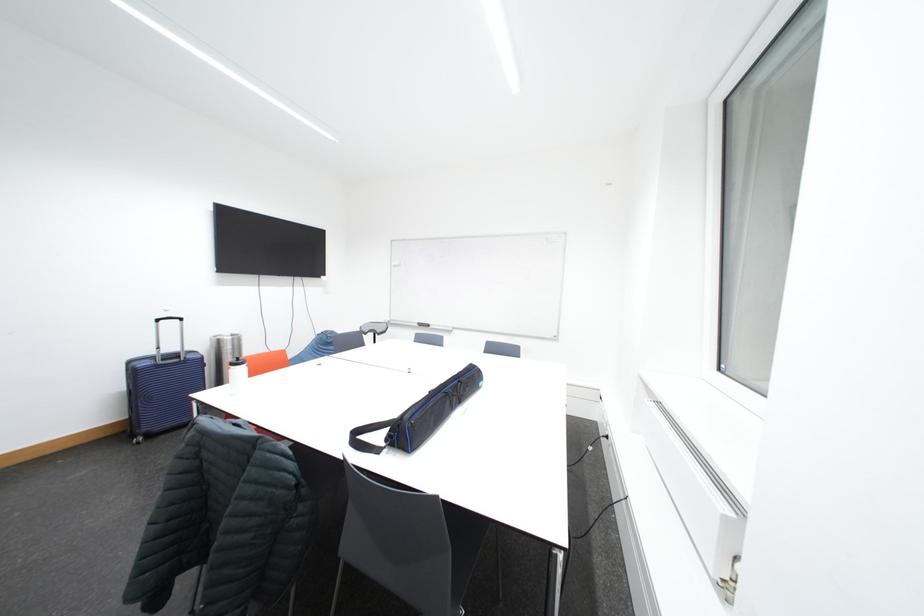
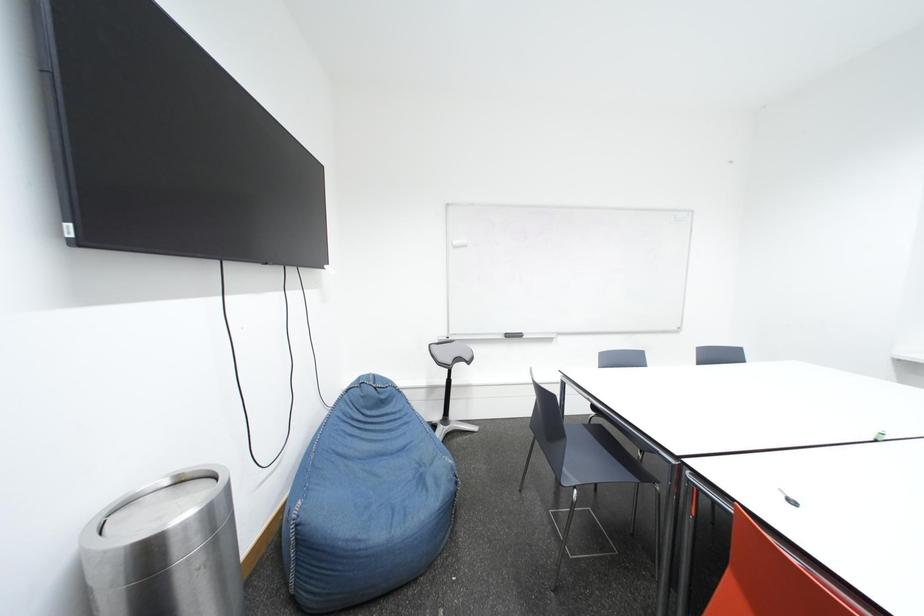
In a continuous first-person perspective shot, in which direction is the camera moving?

The cameraman walked toward left, forward.